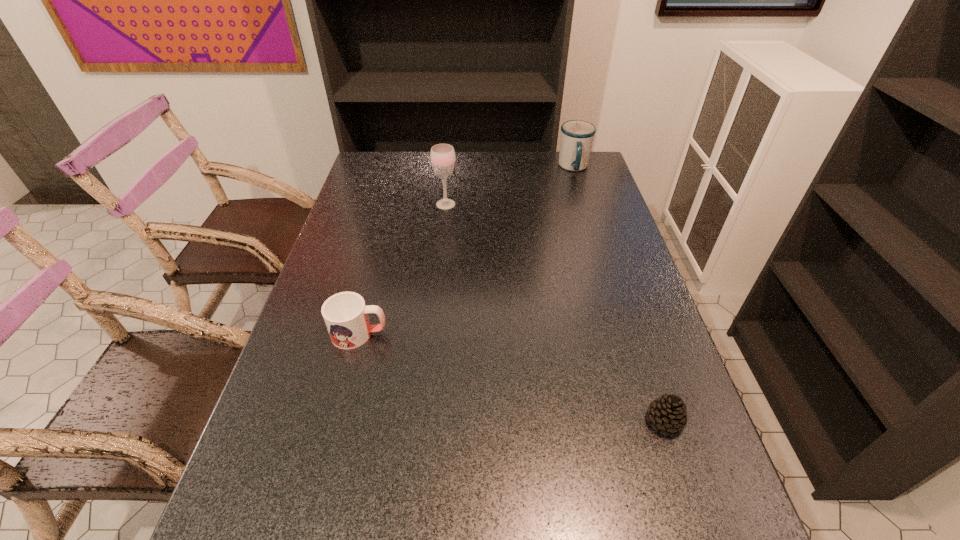
Find the location of `wineglass`. wineglass is located at coordinates [x=442, y=156].

At what (x,y) coordinates should I click in order to perform the action: click on the third object from right to left. Please return your answer as a coordinate pair (x, y). The image size is (960, 540). Looking at the image, I should click on (442, 156).

The image size is (960, 540). Identify the location of the farther mug. (577, 136).

In order to click on the third shortest object in this screenshot , I will do `click(577, 136)`.

The width and height of the screenshot is (960, 540). Identify the location of the leftmost object. (345, 314).

Where is `the left mug`? The image size is (960, 540). the left mug is located at coordinates (345, 314).

This screenshot has height=540, width=960. I want to click on the shortest object, so click(667, 413).

Locate an element on the screen. This screenshot has width=960, height=540. pinecone is located at coordinates (667, 413).

Identify the location of vacant space situated 0.170m on the front of the tallest object. This screenshot has height=540, width=960. (442, 242).

Find the location of a particular element. free space located 0.290m on the handle side of the farther mug is located at coordinates (592, 227).